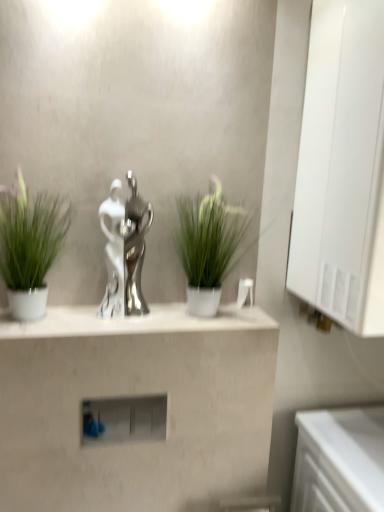
Question: From a real-world perspective, is white glossy counter at lower right physically above silver metallic trophy at center?

Choices:
 (A) no
 (B) yes

Answer: (A)

Question: Is white glossy counter at lower right thinner than silver metallic trophy at center?

Choices:
 (A) no
 (B) yes

Answer: (A)

Question: Would you say white glossy counter at lower right is a long distance from silver metallic trophy at center?

Choices:
 (A) yes
 (B) no

Answer: (B)

Question: Is white glossy counter at lower right to the left of silver metallic trophy at center from the viewer's perspective?

Choices:
 (A) no
 (B) yes

Answer: (A)

Question: Is white glossy counter at lower right at the right side of silver metallic trophy at center?

Choices:
 (A) yes
 (B) no

Answer: (A)

Question: In terms of height, does white glossy medicine cabinet at right look taller or shorter compared to green matte plant at left, which is counted as the 2th houseplant, starting from the right?

Choices:
 (A) tall
 (B) short

Answer: (A)

Question: From the image's perspective, relative to green matte plant at left, which is counted as the first houseplant, starting from the left, is white glossy medicine cabinet at right above or below?

Choices:
 (A) below
 (B) above

Answer: (B)

Question: Is white glossy medicine cabinet at right situated inside green matte plant at left, which is counted as the first houseplant, starting from the left, or outside?

Choices:
 (A) inside
 (B) outside

Answer: (B)

Question: Considering the positions of point (314, 34) and point (11, 202), is point (314, 34) closer or farther from the camera than point (11, 202)?

Choices:
 (A) closer
 (B) farther

Answer: (B)

Question: Considering their positions, is satin silver statue at center located in front of or behind white glossy medicine cabinet at right?

Choices:
 (A) behind
 (B) front

Answer: (A)

Question: Considering the positions of satin silver statue at center and white glossy medicine cabinet at right in the image, is satin silver statue at center wider or thinner than white glossy medicine cabinet at right?

Choices:
 (A) thin
 (B) wide

Answer: (A)

Question: From their relative heights in the image, would you say satin silver statue at center is taller or shorter than white glossy medicine cabinet at right?

Choices:
 (A) tall
 (B) short

Answer: (B)

Question: From the image's perspective, relative to white glossy medicine cabinet at right, is satin silver statue at center above or below?

Choices:
 (A) below
 (B) above

Answer: (A)

Question: Which is correct: matte white shelf at center is inside white glossy medicine cabinet at right, or outside of it?

Choices:
 (A) inside
 (B) outside

Answer: (B)

Question: From their relative heights in the image, would you say matte white shelf at center is taller or shorter than white glossy medicine cabinet at right?

Choices:
 (A) tall
 (B) short

Answer: (B)